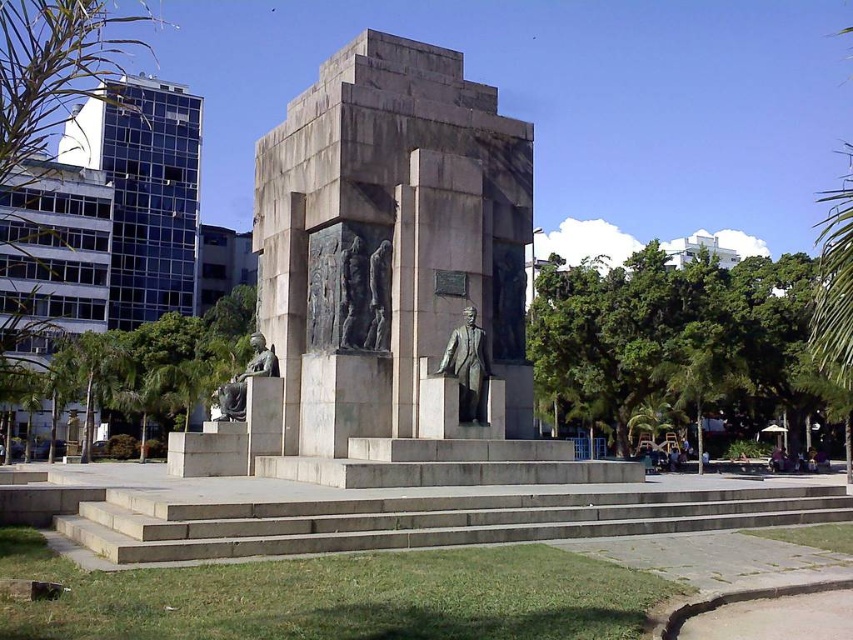
You are a visitor standing in front of the monument and want to take a photo that includes both the black stone relief at center and the green leafy palm tree at right. Which object should you focus on first to ensure both are in frame?

The black stone relief at center is not as tall as the green leafy palm tree at right, so you should focus on the green leafy palm tree at right first to ensure both are in frame.

You are standing at the entrance of the public square and see the bronze sculpture at center and the gray concrete stairs at center. Which object is positioned to the left when facing the monument?

The bronze sculpture at center is positioned to the left of the gray concrete stairs at center when facing the monument.

You are standing in front of the monument and want to locate the black stone relief at center. Can you tell me its coordinates in the image?

The black stone relief at center is located at point (347,288).